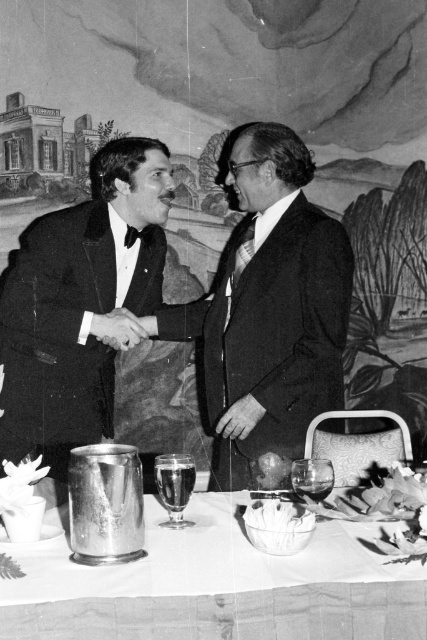
Question: Which of the following is the farthest from the observer?

Choices:
 (A) shiny black suit at center
 (B) shiny black tuxedo at center

Answer: (B)

Question: Does metallic silver pitcher at lower center lie behind shiny black tuxedo at center?

Choices:
 (A) no
 (B) yes

Answer: (A)

Question: Which is farther from the shiny black suit at center?

Choices:
 (A) metallic silver pitcher at lower center
 (B) shiny black tuxedo at center

Answer: (A)

Question: Is shiny black suit at center closer to camera compared to shiny black tuxedo at center?

Choices:
 (A) yes
 (B) no

Answer: (A)

Question: Which object is closer to the camera taking this photo?

Choices:
 (A) metallic silver pitcher at lower center
 (B) shiny black tuxedo at center

Answer: (A)

Question: Does shiny black suit at center have a smaller size compared to shiny black tuxedo at center?

Choices:
 (A) yes
 (B) no

Answer: (B)